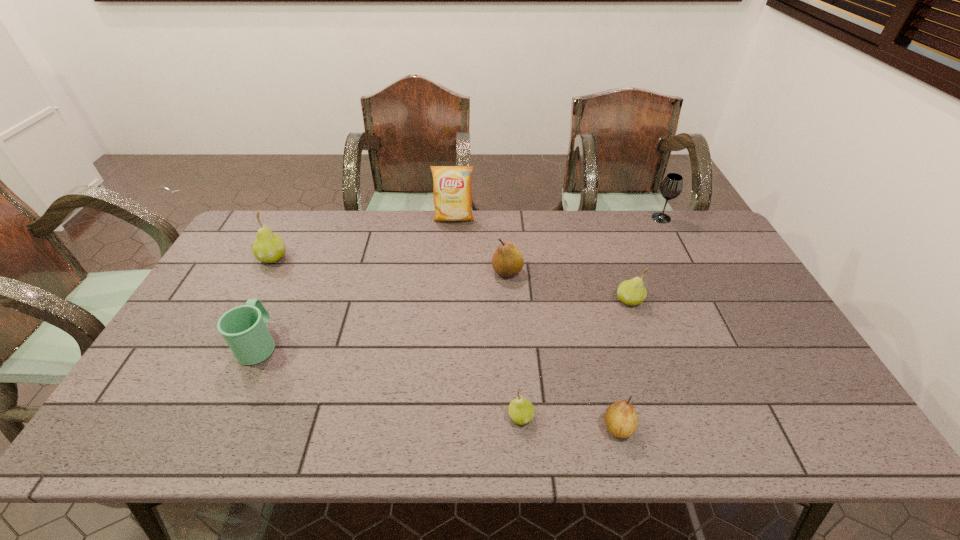
At what (x,y) coordinates should I click in order to perform the action: click on vacant region between the second green pear from left to right and the mug. Please return your answer as a coordinate pair (x, y). This screenshot has width=960, height=540. Looking at the image, I should click on (390, 380).

Find the location of a particular element. free spot between the farther brown pear and the nearer brown pear is located at coordinates (563, 349).

Where is `free space between the rightmost green pear and the third object from left to right`? free space between the rightmost green pear and the third object from left to right is located at coordinates (541, 259).

What are the coordinates of `free spot between the second green pear from left to right and the second biggest green pear` in the screenshot? It's located at (575, 359).

Find the location of a particular element. The width and height of the screenshot is (960, 540). vacant area that lies between the sixth object from right to left and the farthest green pear is located at coordinates (364, 238).

Where is `free space between the right brown pear and the rightmost object`? The width and height of the screenshot is (960, 540). free space between the right brown pear and the rightmost object is located at coordinates (639, 322).

Where is `empty space that is in between the second farthest green pear and the left brown pear`? The width and height of the screenshot is (960, 540). empty space that is in between the second farthest green pear and the left brown pear is located at coordinates (568, 286).

Where is `free space between the gray wineglass and the farther brown pear`? The image size is (960, 540). free space between the gray wineglass and the farther brown pear is located at coordinates (585, 245).

What are the coordinates of `vacant space that is in between the mug and the seventh object from left to right` in the screenshot? It's located at (444, 322).

This screenshot has height=540, width=960. What are the coordinates of `free space between the wineglass and the left brown pear` in the screenshot? It's located at (585, 245).